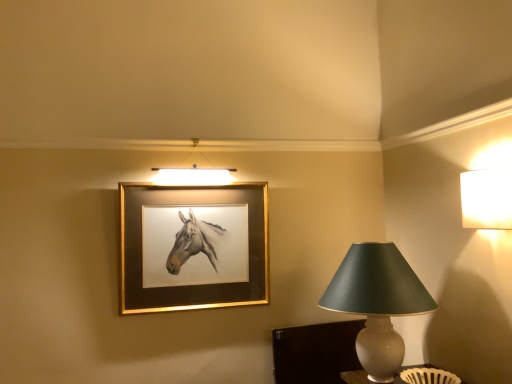
Question: Is white textured lampshade at upper right, the 1th lamp when ordered from top to bottom, positioned with its back to matte gray lampshade at right, the first lamp ordered from the bottom?

Choices:
 (A) no
 (B) yes

Answer: (A)

Question: Considering the relative sizes of white textured lampshade at upper right, placed as the second lamp when sorted from bottom to top, and matte gray lampshade at right, which is the 1th lamp in left-to-right order, in the image provided, is white textured lampshade at upper right, placed as the second lamp when sorted from bottom to top, wider than matte gray lampshade at right, which is the 1th lamp in left-to-right order,?

Choices:
 (A) no
 (B) yes

Answer: (A)

Question: Does white textured lampshade at upper right, which appears as the second lamp when viewed from the left, have a smaller size compared to matte gray lampshade at right, placed as the second lamp when sorted from right to left?

Choices:
 (A) yes
 (B) no

Answer: (A)

Question: Is the depth of white textured lampshade at upper right, arranged as the first lamp when viewed from the right, less than that of matte gray lampshade at right, the first lamp ordered from the bottom?

Choices:
 (A) no
 (B) yes

Answer: (B)

Question: Does white textured lampshade at upper right, placed as the second lamp when sorted from bottom to top, lie behind matte gray lampshade at right, the first lamp ordered from the bottom?

Choices:
 (A) yes
 (B) no

Answer: (B)

Question: From the image's perspective, is white textured lampshade at upper right, arranged as the first lamp when viewed from the right, below matte gray lampshade at right, acting as the second lamp starting from the top?

Choices:
 (A) no
 (B) yes

Answer: (A)

Question: Is matte gray lampshade at right, acting as the second lamp starting from the top, oriented towards gold metallic picture frame at upper center?

Choices:
 (A) yes
 (B) no

Answer: (B)

Question: Can you confirm if matte gray lampshade at right, placed as the second lamp when sorted from right to left, is bigger than gold metallic picture frame at upper center?

Choices:
 (A) yes
 (B) no

Answer: (A)

Question: From a real-world perspective, is matte gray lampshade at right, acting as the second lamp starting from the top, positioned over gold metallic picture frame at upper center based on gravity?

Choices:
 (A) yes
 (B) no

Answer: (B)

Question: Considering the relative sizes of matte gray lampshade at right, placed as the second lamp when sorted from right to left, and gold metallic picture frame at upper center in the image provided, is matte gray lampshade at right, placed as the second lamp when sorted from right to left, wider than gold metallic picture frame at upper center?

Choices:
 (A) no
 (B) yes

Answer: (B)

Question: From the image's perspective, is matte gray lampshade at right, acting as the second lamp starting from the top, under gold metallic picture frame at upper center?

Choices:
 (A) yes
 (B) no

Answer: (A)

Question: Is matte gray lampshade at right, placed as the second lamp when sorted from right to left, not near gold metallic picture frame at upper center?

Choices:
 (A) yes
 (B) no

Answer: (B)

Question: From the image's perspective, is white textured lampshade at upper right, the 1th lamp when ordered from top to bottom, over gold metallic picture frame at upper center?

Choices:
 (A) no
 (B) yes

Answer: (B)